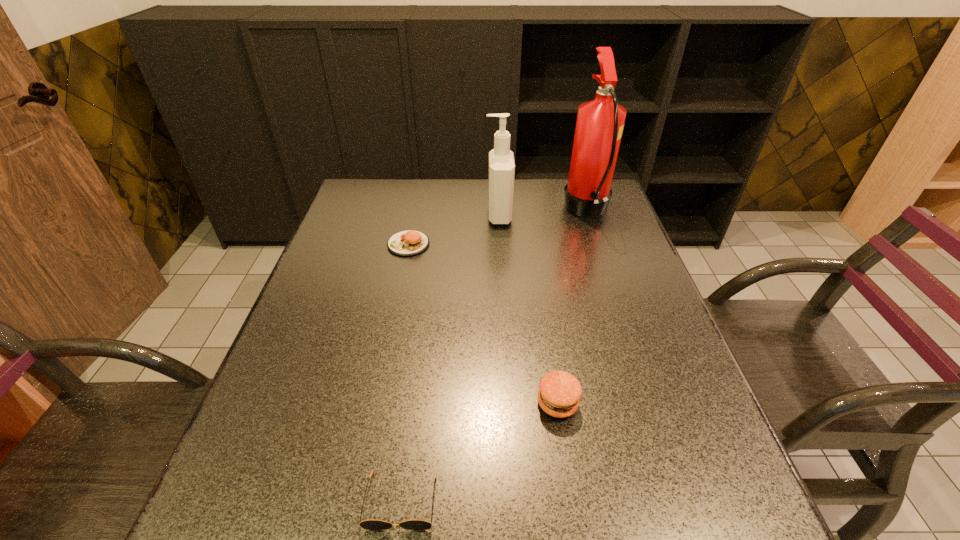
At what (x,y) coordinates should I click in order to perform the action: click on free location located at the spray nozzle of the tallest object. Please return your answer as a coordinate pair (x, y). This screenshot has width=960, height=540. Looking at the image, I should click on (471, 211).

Locate an element on the screen. This screenshot has height=540, width=960. blank space located 0.210m at the spray nozzle of the tallest object is located at coordinates (497, 211).

You are a GUI agent. You are given a task and a screenshot of the screen. Output one action in this format:
    pyautogui.click(x=<x>, y=<y>)
    Task: Click on the vacant region located 0.130m on the front label of the third object from left to right
    
    Given the screenshot: What is the action you would take?
    pyautogui.click(x=444, y=215)

Where is `vacant position located on the front label of the third object from left to right`? This screenshot has width=960, height=540. vacant position located on the front label of the third object from left to right is located at coordinates 457,215.

Where is `vacant space positioned on the front label of the third object from left to right`? This screenshot has width=960, height=540. vacant space positioned on the front label of the third object from left to right is located at coordinates (376, 215).

The width and height of the screenshot is (960, 540). What are the coordinates of `free space located on the left of the fourth object from left to right` in the screenshot? It's located at (348, 403).

Identify the location of vacant space located 0.070m on the left of the farther patty. The height and width of the screenshot is (540, 960). (363, 244).

In order to click on fire extinguisher present at the far edge in this screenshot , I will do `click(600, 122)`.

In order to click on cleansing agent that is at the far edge in this screenshot , I will do `click(501, 175)`.

I want to click on object that is at the near edge, so [366, 524].